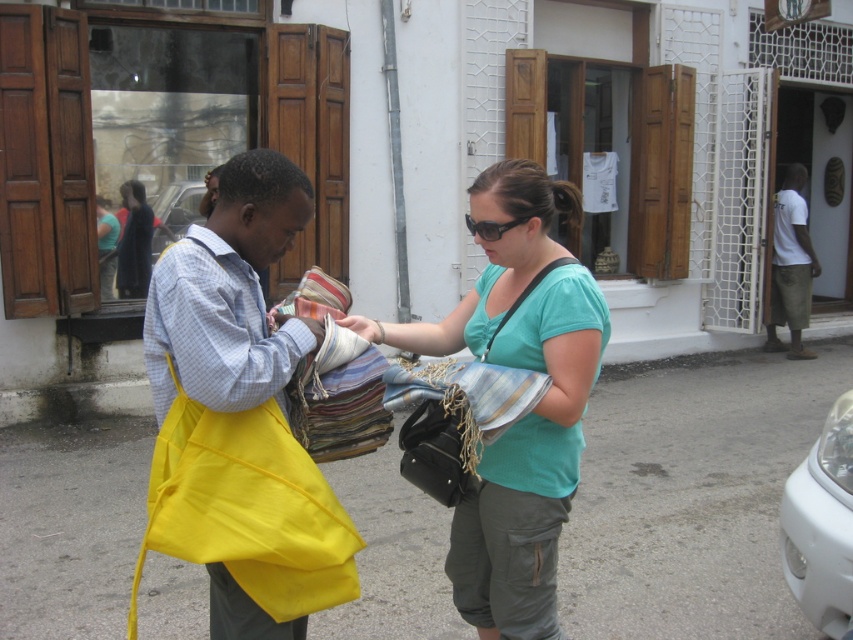
Question: Can you confirm if yellow fabric bag at center is positioned below metallic silver car at center?

Choices:
 (A) yes
 (B) no

Answer: (A)

Question: Estimate the real-world distances between objects in this image. Which object is farther from the teal cotton shirt at center?

Choices:
 (A) yellow fabric bag at center
 (B) white cotton shirt at right
 (C) white glossy car at right

Answer: (B)

Question: Where is yellow fabric bag at center located in relation to white glossy car at right in the image?

Choices:
 (A) above
 (B) below

Answer: (A)

Question: Which point is closer to the camera taking this photo?

Choices:
 (A) (839, 490)
 (B) (566, 365)
 (C) (247, 236)

Answer: (C)

Question: Based on their relative distances, which object is farther from the metallic silver car at center?

Choices:
 (A) white cotton shirt at right
 (B) teal cotton shirt at center
 (C) white glossy car at right

Answer: (A)

Question: Is yellow fabric bag at center positioned before metallic silver car at center?

Choices:
 (A) no
 (B) yes

Answer: (B)